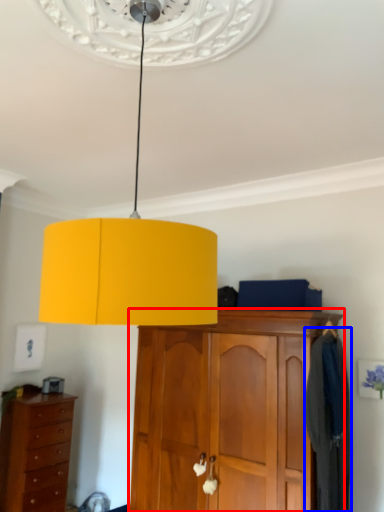
Question: Which object appears closest to the camera in this image, cabinetry (highlighted by a red box) or clothing (highlighted by a blue box)?

Choices:
 (A) cabinetry
 (B) clothing

Answer: (A)